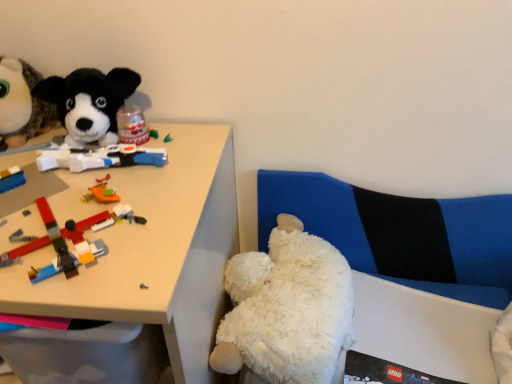
Where is `unoccupied region to the right of brick-like plastic toys at left, placed as the second toy when sorted from left to right`? The height and width of the screenshot is (384, 512). unoccupied region to the right of brick-like plastic toys at left, placed as the second toy when sorted from left to right is located at coordinates (167, 221).